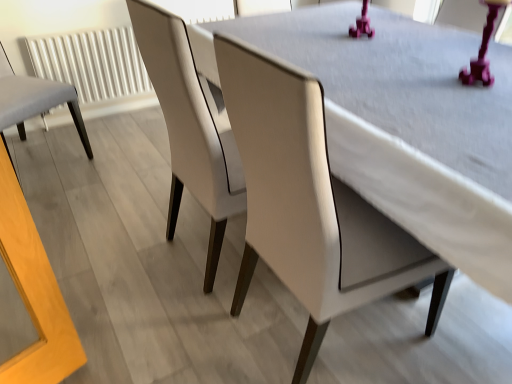
Identify the location of vacant space in front of matte white chair at center, arranged as the 2th chair when viewed from the left. This screenshot has width=512, height=384. (185, 326).